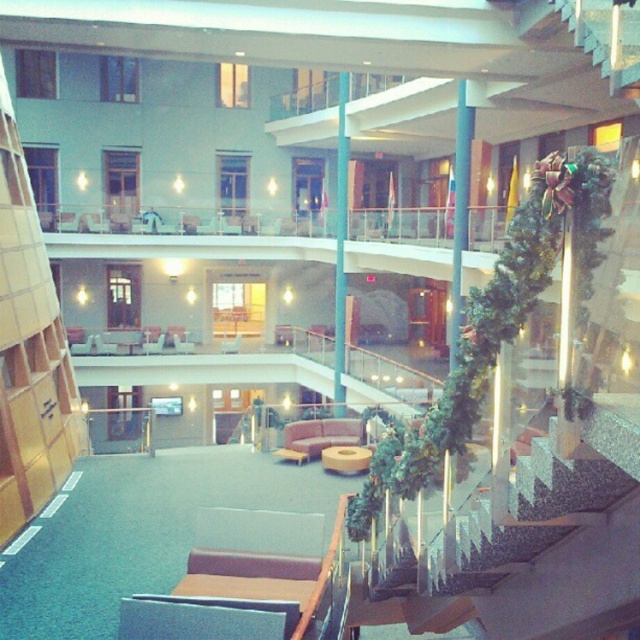
From the picture: You are standing at the entrance of the building and see the blue glossy pillar at center. If you walk straight ahead, will you reach the pillar before the staircase?

The blue glossy pillar at center is located at point (340, 244), which is closer to the entrance than the staircase, so yes, you will reach the pillar before the staircase.

You are standing at the entrance of the building and see the point marked at coordinates (340, 244). What object is located at this point?

The point at coordinates (340, 244) indicates the blue glossy pillar at center.

You are standing in the atrium of the building and want to reach the point marked at coordinates point (342, 204). If you walk straight ahead, will you reach that point before walking 25 meters?

The point (342, 204) is 20.03 meters from the viewer. Since 20.03 meters is less than 25 meters, you will reach the point before walking 25 meters.